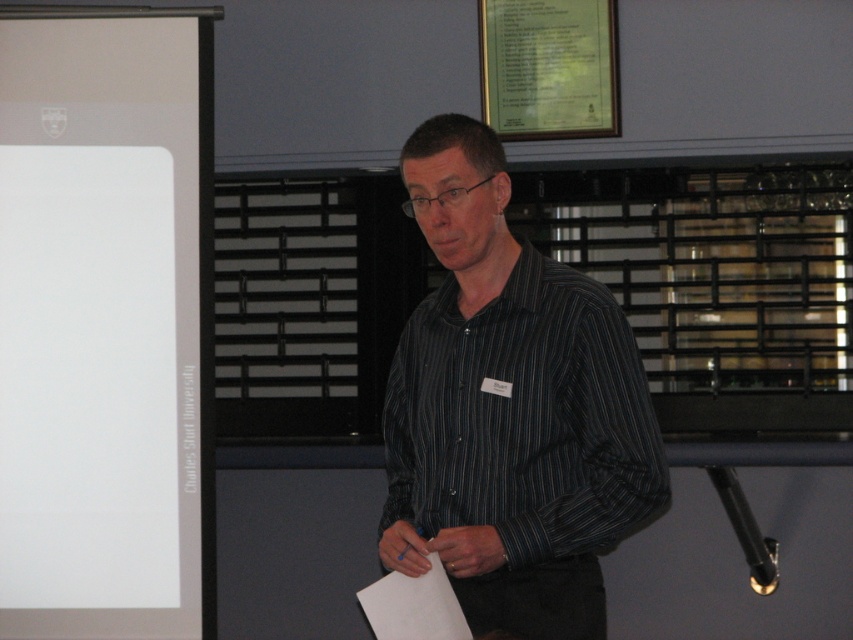
You are an attendee at this presentation. You notice the dark striped shirt at center and the green paper at upper center. Which object is located to the left of the other?

The dark striped shirt at center is positioned on the left side of green paper at upper center.

In the scene shown: You are an attendee at a conference. You want to take a photo of the presenter and the white matte projection screen at left in the background. The screen is located at coordinates point [105,326]. To ensure both the presenter and the screen are in focus, what should you do?

You should focus at the point [105,326] where the white matte projection screen at left is located to ensure both the presenter and the screen are in focus.

In the scene shown: You are an attendee at a conference and need to locate the speaker. The speaker is standing between the white matte projection screen at left and the green paper at upper center. Which object is closer to you, the attendee?

The white matte projection screen at left is closer to you because it is in front of the green paper at upper center.